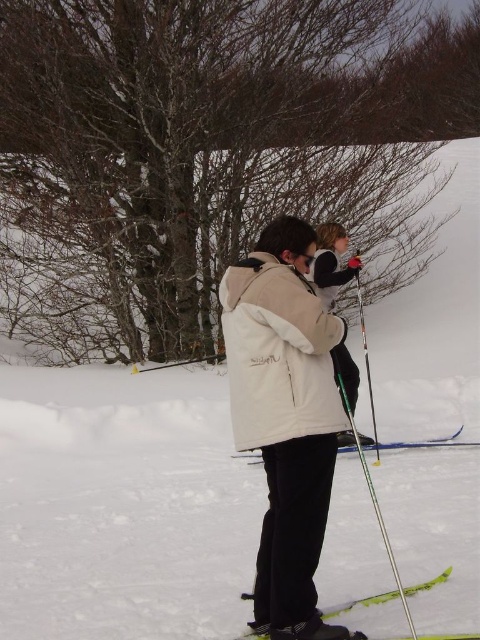
Question: Which point is closer to the camera?

Choices:
 (A) green glossy ski at lower center
 (B) green plastic ski pole at center

Answer: (B)

Question: Is green plastic ski pole at center below blue plastic ski at center?

Choices:
 (A) yes
 (B) no

Answer: (B)

Question: Which object appears farthest from the camera in this image?

Choices:
 (A) blue plastic ski at center
 (B) white fleece jacket at center

Answer: (A)

Question: Is white fleece jacket at center wider than green plastic ski pole at center?

Choices:
 (A) no
 (B) yes

Answer: (A)

Question: Is white fleece jacket at center to the left of blue plastic ski at center from the viewer's perspective?

Choices:
 (A) yes
 (B) no

Answer: (A)

Question: Considering the real-world distances, which object is closest to the blue plastic ski at center?

Choices:
 (A) green glossy ski at lower center
 (B) green plastic ski pole at center
 (C) white fleece jacket at center

Answer: (B)